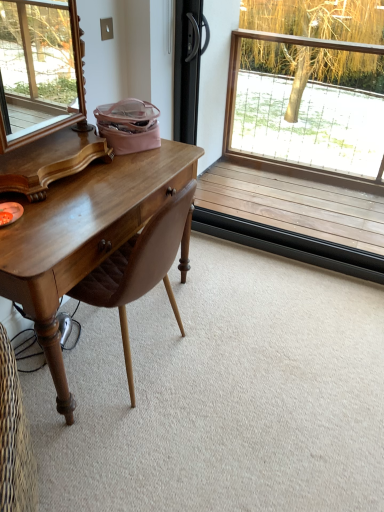
Where is `vacant area in front of brown leather chair at left`? vacant area in front of brown leather chair at left is located at coordinates (140, 450).